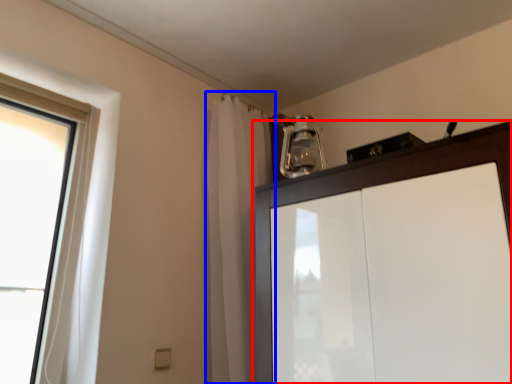
Question: Which point is further to the camera, cupboard (highlighted by a red box) or shower curtain (highlighted by a blue box)?

Choices:
 (A) cupboard
 (B) shower curtain

Answer: (B)